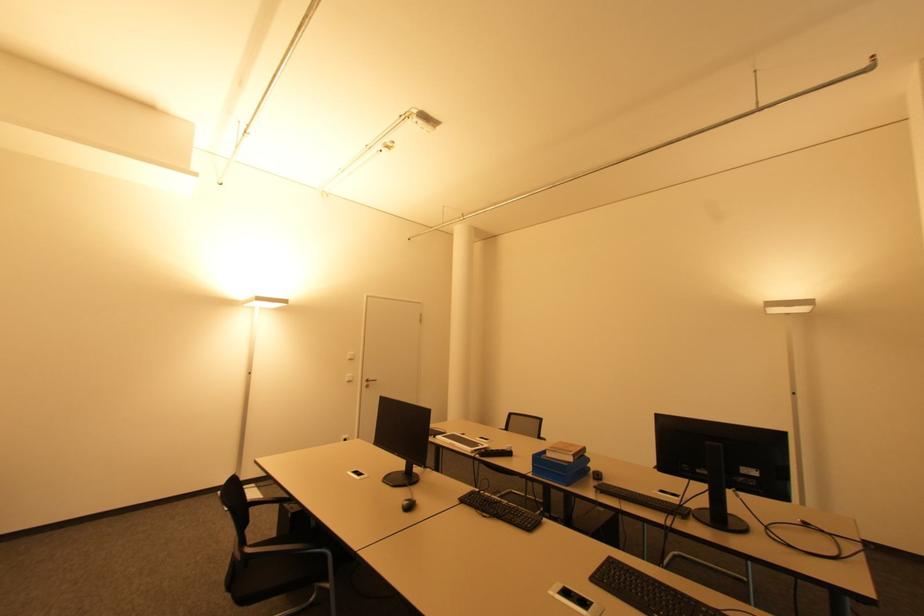
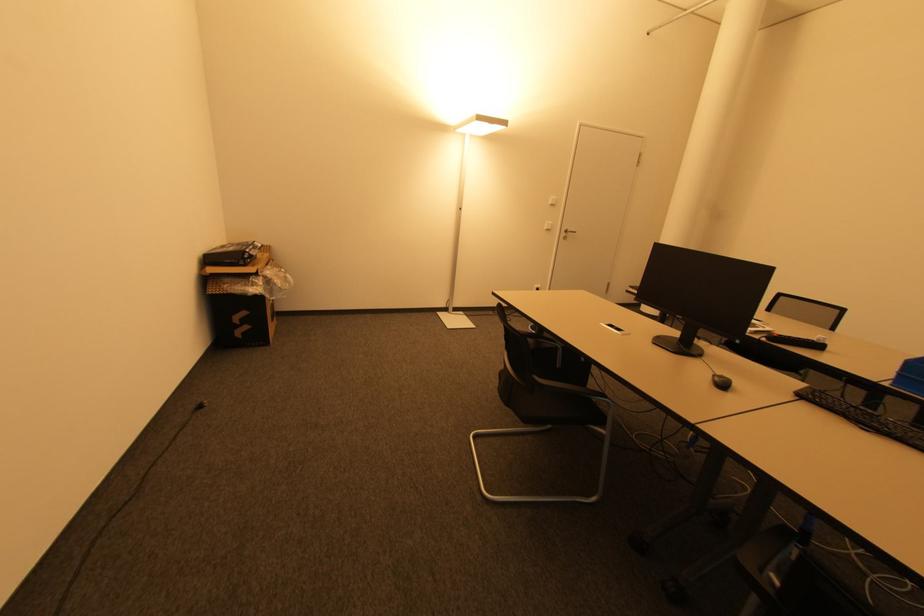
In the second image, find the point that corresponds to point 535,475 in the first image.

(894, 386)